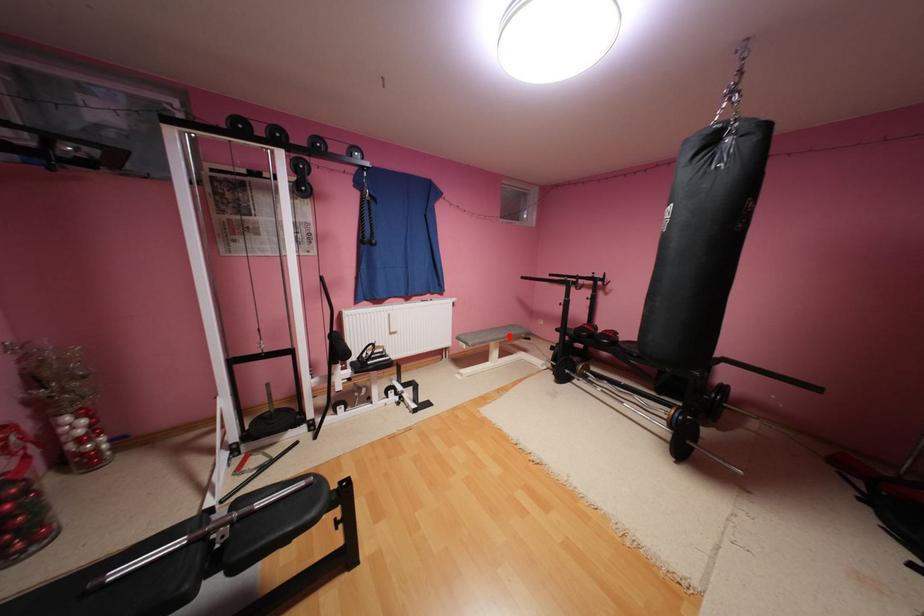
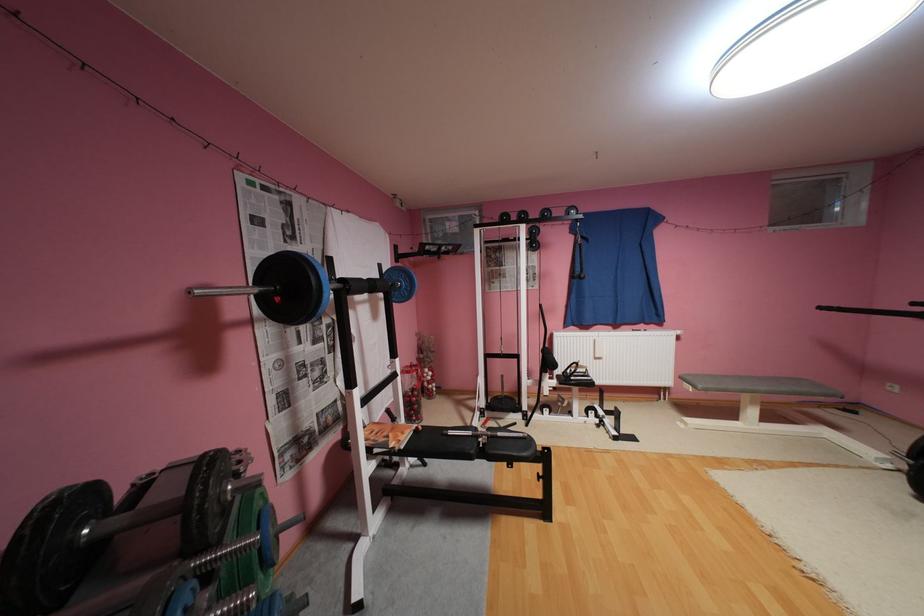
The point at the highlighted location is marked in the first image. Where is the corresponding point in the second image?

(771, 387)